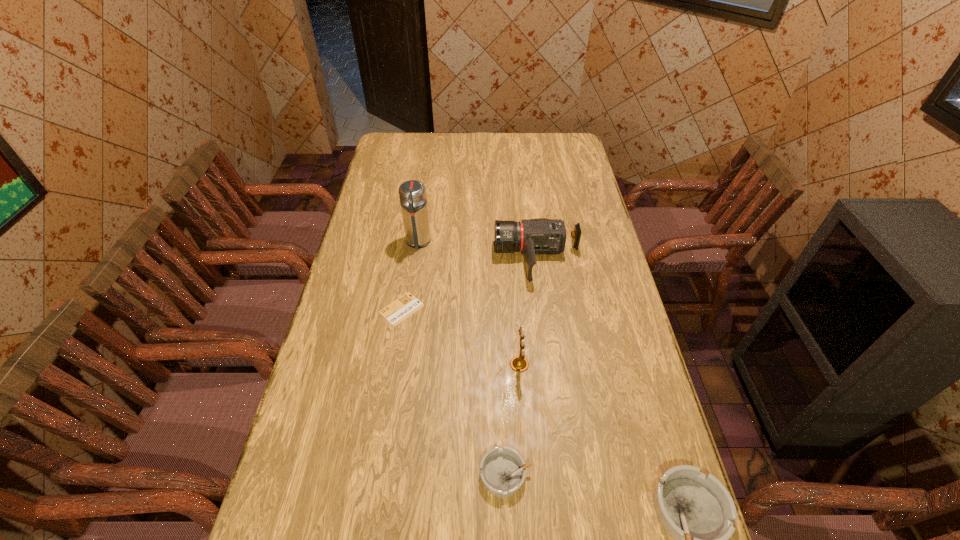
Please point a free position for a ashtray on the left. Please provide its 2D coordinates. Your answer should be formatted as a tuple, i.e. [(x, y)], where the tuple contains the x and y coordinates of a point satisfying the conditions above.

[(340, 440)]